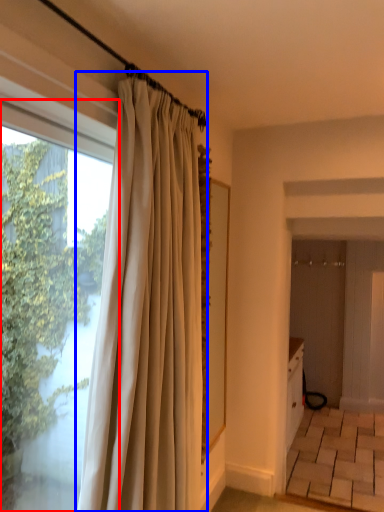
Question: Which object appears closest to the camera in this image, window (highlighted by a red box) or curtain (highlighted by a blue box)?

Choices:
 (A) window
 (B) curtain

Answer: (A)